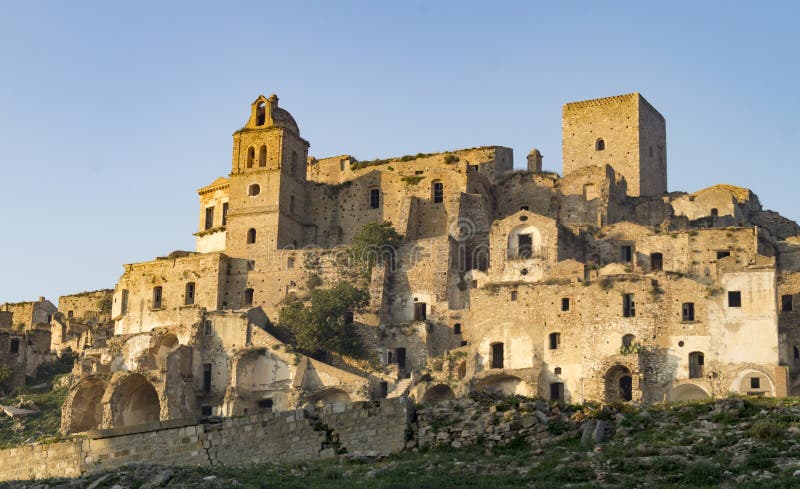
Find the location of a particular element. The image size is (800, 489). stairs is located at coordinates (400, 390).